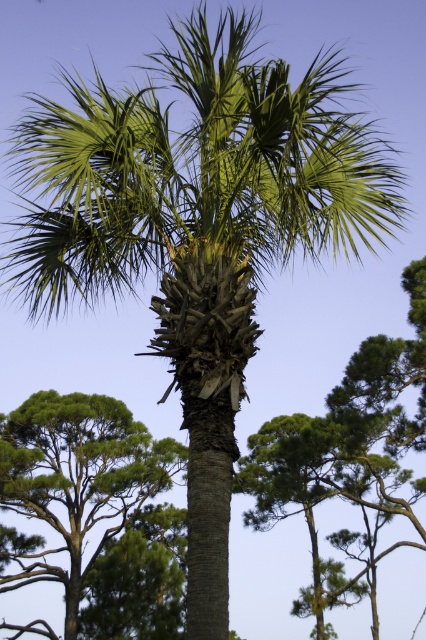
You are standing in a garden with a green leafy palm at center and a green leafy tree at lower left. Which tree is taller?

The green leafy palm at center is taller than the green leafy tree at lower left.

You are standing at a distance and want to take a photo of the green leafy palm at center. If your camera can focus on objects up to 80 feet away, will you be able to capture a clear photo of the palm?

The green leafy palm at center and camera are 79.16 feet apart, which is within the camera focus range of up to 80 feet. Therefore, you can capture a clear photo of the palm.

You are standing in a garden and want to find the green leafy palm at center. Which direction should you look relative to the green leafy tree at lower left?

The green leafy palm at center is to the right of the green leafy tree at lower left, so you should look to the right of the green leafy tree at lower left to find it.